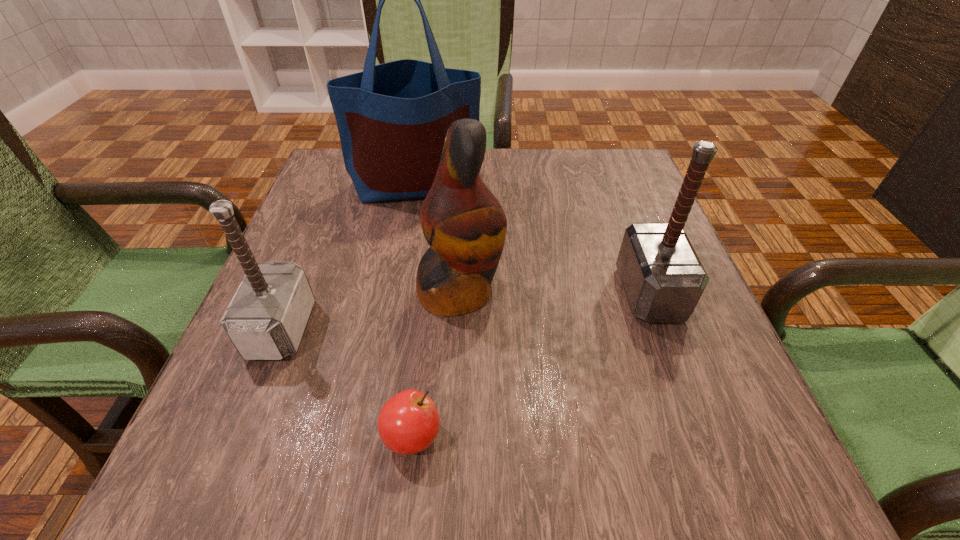
Where is `free space between the rightmost object and the apple`? free space between the rightmost object and the apple is located at coordinates (531, 364).

Image resolution: width=960 pixels, height=540 pixels. In order to click on blank region between the handbag and the apple in this screenshot , I will do `click(415, 310)`.

At what (x,y) coordinates should I click in order to perform the action: click on vacant point located between the right hammer and the nearest object. Please return your answer as a coordinate pair (x, y). Image resolution: width=960 pixels, height=540 pixels. Looking at the image, I should click on (531, 364).

At what (x,y) coordinates should I click in order to perform the action: click on free point between the shortest object and the left hammer. Please return your answer as a coordinate pair (x, y). Looking at the image, I should click on (347, 382).

Select which object is the third closest to the left hammer. Please provide its 2D coordinates. Your answer should be formatted as a tuple, i.e. [(x, y)], where the tuple contains the x and y coordinates of a point satisfying the conditions above.

[(392, 118)]

Identify which object is located as the fourth nearest to the right hammer. Please provide its 2D coordinates. Your answer should be formatted as a tuple, i.e. [(x, y)], where the tuple contains the x and y coordinates of a point satisfying the conditions above.

[(265, 320)]

Where is `free spot that satisfies the following two spatial constraints: 1. on the face of the rightmost object; 2. on the right side of the parrot`? The image size is (960, 540). free spot that satisfies the following two spatial constraints: 1. on the face of the rightmost object; 2. on the right side of the parrot is located at coordinates (461, 293).

The image size is (960, 540). Find the location of `vacant space that satisfies the following two spatial constraints: 1. on the face of the parrot; 2. on the left side of the rightmost object`. vacant space that satisfies the following two spatial constraints: 1. on the face of the parrot; 2. on the left side of the rightmost object is located at coordinates (461, 293).